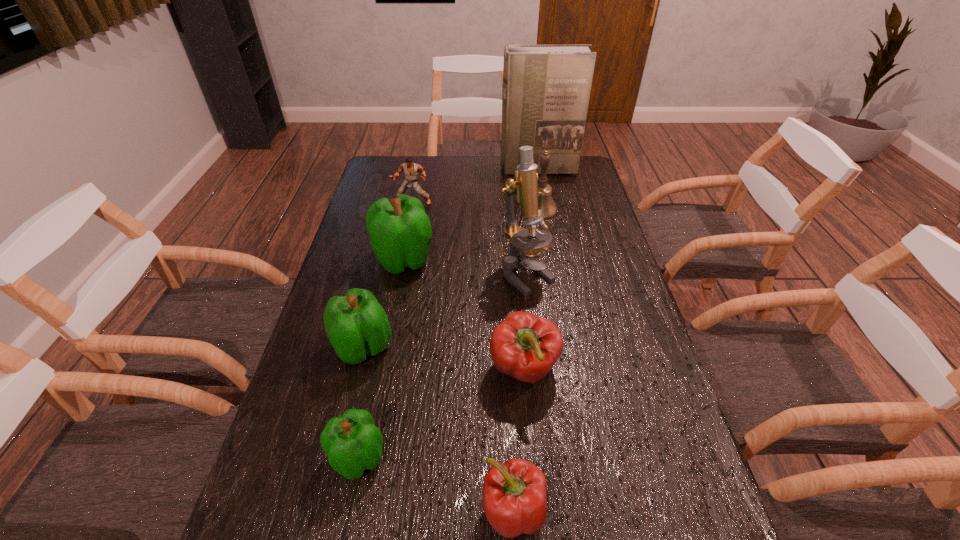
This screenshot has width=960, height=540. I want to click on bell located in the right edge section of the desktop, so click(547, 208).

The image size is (960, 540). What are the coordinates of `object positioned at the far right corner` in the screenshot? It's located at (546, 88).

In the image, there is a desktop. At what (x,y) coordinates should I click in order to perform the action: click on blank space at the far edge. Please return your answer as a coordinate pair (x, y). Looking at the image, I should click on (x=489, y=159).

The image size is (960, 540). What are the coordinates of `vacant space at the left edge` in the screenshot? It's located at (326, 455).

This screenshot has width=960, height=540. In order to click on vacant space at the right edge in this screenshot , I will do `click(664, 521)`.

Identify the location of vacant area that lies between the farthest green bell pepper and the bell. [x=471, y=234].

Identify the location of unoccupied area between the farthest green bell pepper and the farthest object. Image resolution: width=960 pixels, height=540 pixels. (470, 214).

Find the location of a particular element. vacant area that lies between the bell and the puncher is located at coordinates (476, 207).

Where is `free spot between the bell and the farther pink bell pepper`? Image resolution: width=960 pixels, height=540 pixels. free spot between the bell and the farther pink bell pepper is located at coordinates (532, 289).

The image size is (960, 540). What are the coordinates of `object that stands as the seventh closest to the microscope` in the screenshot? It's located at (546, 88).